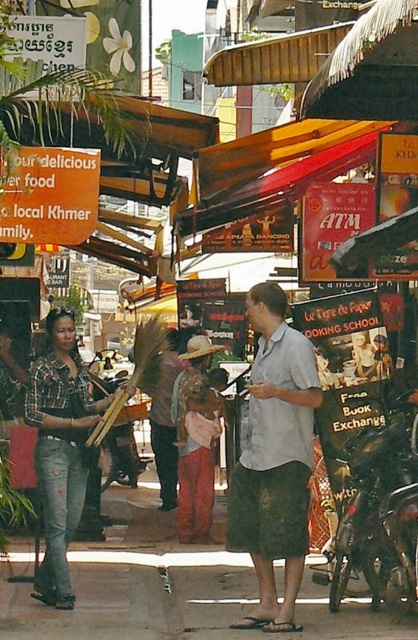
Looking at this image, you are a photographer standing at the center of the scene. You want to take a photo of the denim jeans at center. However, there is an obstacle 3 meters away from you. Can you still take the photo without moving?

The denim jeans at center are 8.84 meters away from you. Since the obstacle is only 3 meters away, which is closer than the jeans, you can still take the photo by moving around the obstacle or adjusting your angle to avoid it, as the jeans are further away.

You are a photographer standing in the middle of the street. You want to take a photo of the shiny black motorcycle at center without including the denim jeans at center in the frame. Is this possible given their positions?

The denim jeans at center is further to the viewer than the shiny black motorcycle at center. Therefore, since the denim jeans is closer to you, it would block the view of the motorcycle behind it, making it impossible to capture the motorcycle without including the jeans in the frame.